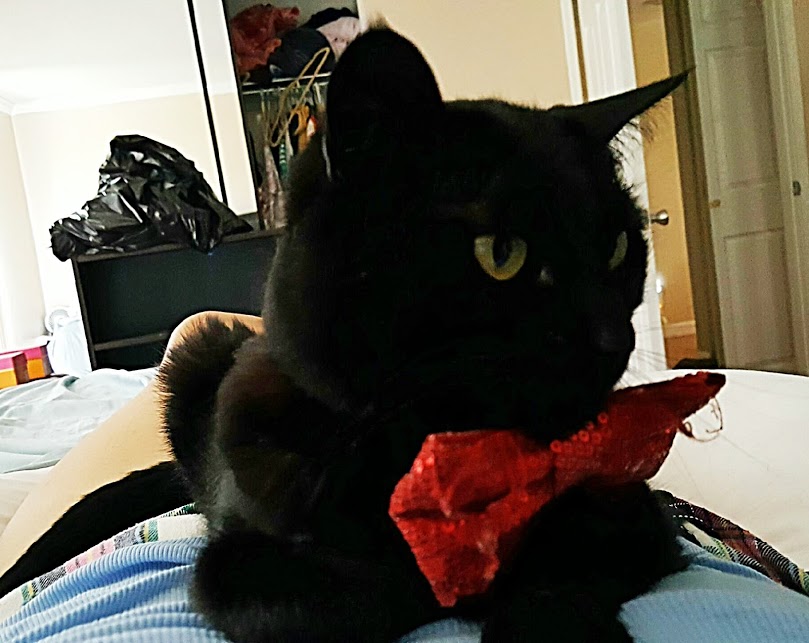
At what (x,y) coordinates should I click in order to perform the action: click on bed. Please return your answer as a coordinate pair (x, y). The height and width of the screenshot is (643, 809). Looking at the image, I should click on (719, 476).